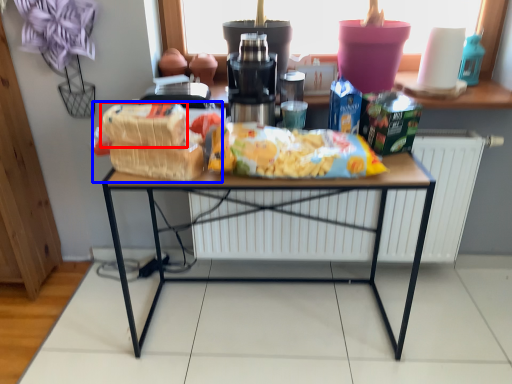
Question: Which point is further to the camera, cereal (highlighted by a red box) or snack (highlighted by a blue box)?

Choices:
 (A) cereal
 (B) snack

Answer: (B)